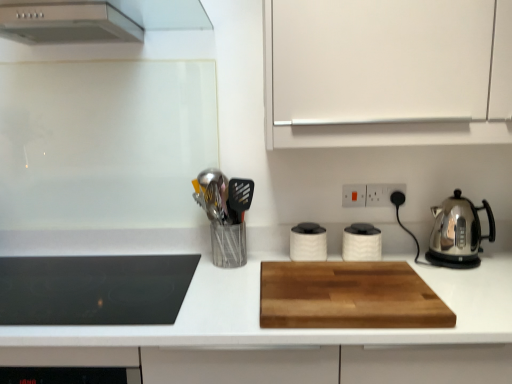
Locate an element on the screen. The image size is (512, 384). vacant area on top of wooden cutting board at center (from a real-world perspective) is located at coordinates (344, 273).